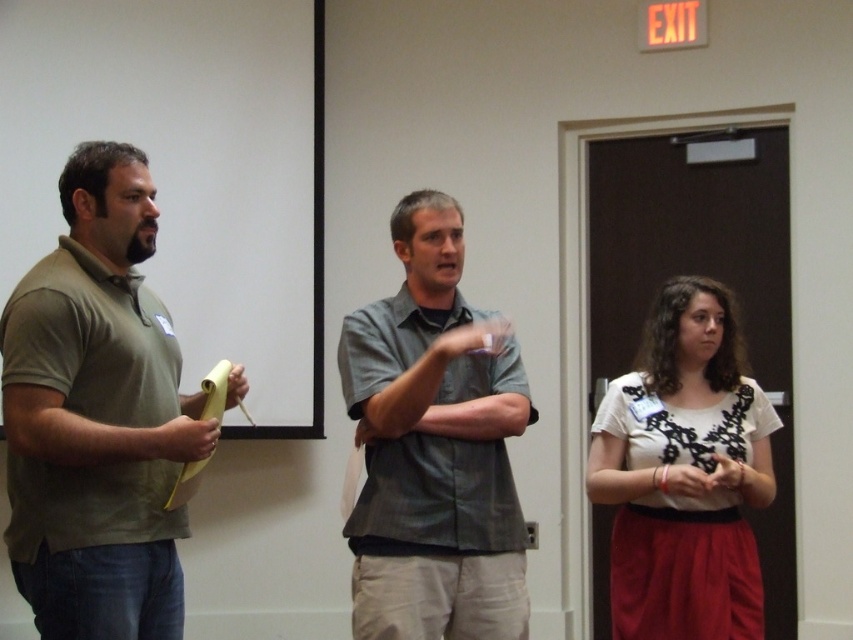
You are organizing a group photo and need to arrange the matte green polo shirt at left and the gray cotton shirt at center based on their widths. Which shirt should be placed on the narrower side of the arrangement?

The matte green polo shirt at left has a lesser width compared to the gray cotton shirt at center, so it should be placed on the narrower side of the arrangement.

You are organizing a charity event and need to arrange seating based on the sizes of the attendees. The attendees include the matte green polo shirt at left and the gray cotton shirt at center. Which attendee requires a larger seat size?

The matte green polo shirt at left requires a larger seat size because it has a larger size compared to the gray cotton shirt at center according to the description.

You are organizing a photo shoot and need to ensure that the matte green polo shirt at left and the white lace fabric at center are visible in the frame. Based on their sizes, which object should you prioritize positioning closer to the camera to maintain clarity?

The matte green polo shirt at left should be positioned closer to the camera because it occupies less space than the white lace fabric at center, making it smaller and potentially harder to see from a distance.